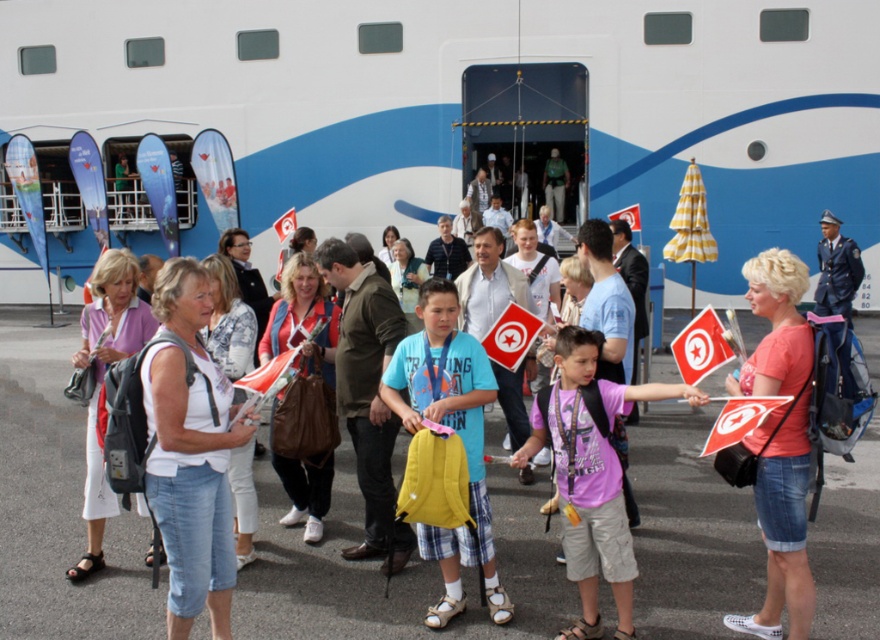
You are a photographer standing at the edge of the port. You want to take a photo of the white glossy cruise ship at upper center and the yellow fabric backpack at center. Which object should you focus on first if you want to capture both in the frame without moving the camera?

You should focus on the white glossy cruise ship at upper center first because it might be wider than the yellow fabric backpack at center, so capturing it first ensures it fits in the frame.

What is the location of the point with coordinates (x=470, y=112) in the image?

The point with coordinates (x=470, y=112) is located on the white glossy cruise ship at upper center.

You are a photographer trying to capture a clear shot of the purple cotton shirt at center and the yellow fabric backpack at center. Since you want both items to be fully visible in your frame, which object should you focus on first to ensure it doesn t get cropped out?

The purple cotton shirt at center is shorter than the yellow fabric backpack at center, so you should focus on the yellow fabric backpack at center first to ensure it doesn t get cropped out because it is taller.